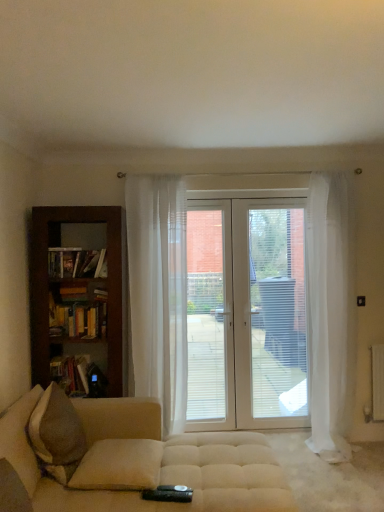
Question: Can you confirm if beige fabric pillow at lower center, which is the 1th pillow from right to left, is taller than sheer white curtain at center, which appears as the 1th curtain when viewed from the left?

Choices:
 (A) yes
 (B) no

Answer: (B)

Question: Could you tell me if beige fabric pillow at lower center, the 2th pillow in the left-to-right sequence, is turned towards sheer white curtain at center, the 2th curtain in the right-to-left sequence?

Choices:
 (A) yes
 (B) no

Answer: (B)

Question: Would you say beige fabric pillow at lower center, arranged as the 1th pillow when viewed from the back, contains sheer white curtain at center, which appears as the 1th curtain when viewed from the left?

Choices:
 (A) yes
 (B) no

Answer: (B)

Question: Would you consider beige fabric pillow at lower center, which is the 1th pillow from right to left, to be distant from sheer white curtain at center, the 2th curtain in the right-to-left sequence?

Choices:
 (A) yes
 (B) no

Answer: (A)

Question: From the image's perspective, would you say beige fabric pillow at lower center, arranged as the 1th pillow when viewed from the back, is positioned over sheer white curtain at center, the 2th curtain in the right-to-left sequence?

Choices:
 (A) yes
 (B) no

Answer: (B)

Question: From a real-world perspective, is beige fabric pillow at lower center, which is the 1th pillow from right to left, positioned under sheer white curtain at center, which appears as the 1th curtain when viewed from the left, based on gravity?

Choices:
 (A) no
 (B) yes

Answer: (B)

Question: Is wooden bookshelf at left, the 1th book viewed from the top, bigger than hardcover book at left, which is counted as the first book, starting from the bottom?

Choices:
 (A) yes
 (B) no

Answer: (B)

Question: From the image's perspective, is wooden bookshelf at left, the 1th book viewed from the top, beneath hardcover book at left, the second book positioned from the top?

Choices:
 (A) yes
 (B) no

Answer: (B)

Question: Can you confirm if wooden bookshelf at left, the 1th book viewed from the top, is wider than hardcover book at left, the second book positioned from the top?

Choices:
 (A) yes
 (B) no

Answer: (B)

Question: From the image's perspective, is wooden bookshelf at left, the 1th book viewed from the top, on hardcover book at left, the second book positioned from the top?

Choices:
 (A) yes
 (B) no

Answer: (A)

Question: Does wooden bookshelf at left, the 1th book viewed from the top, have a lesser width compared to hardcover book at left, which is counted as the first book, starting from the bottom?

Choices:
 (A) no
 (B) yes

Answer: (B)

Question: Is wooden bookshelf at left, the 1th book viewed from the top, at the right side of hardcover book at left, which is counted as the first book, starting from the bottom?

Choices:
 (A) no
 (B) yes

Answer: (B)

Question: Can you confirm if dark wood bookcase at left is bigger than hardcover book at left, which is counted as the first book, starting from the bottom?

Choices:
 (A) no
 (B) yes

Answer: (B)